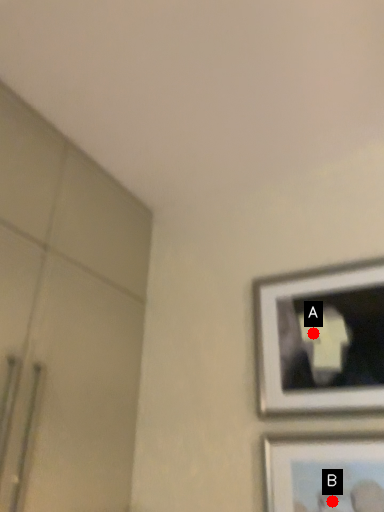
Question: Two points are circled on the image, labeled by A and B beside each circle. Which of the following is the closest to the observer?

Choices:
 (A) A is closer
 (B) B is closer

Answer: (B)